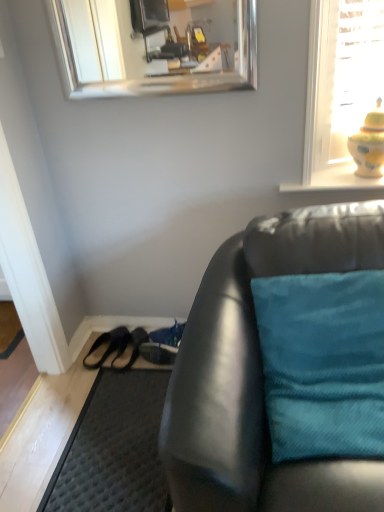
The width and height of the screenshot is (384, 512). Describe the element at coordinates (114, 449) in the screenshot. I see `dark gray textured doormat at lower left` at that location.

What do you see at coordinates (168, 335) in the screenshot?
I see `shiny blue shoe at lower center, the third shoe positioned from the left` at bounding box center [168, 335].

Where is `silver/metallic mirror at upper center`? This screenshot has height=512, width=384. silver/metallic mirror at upper center is located at coordinates (x=154, y=46).

In order to click on yellow glazed vase at upper right in this screenshot , I will do `click(369, 144)`.

How much space does black leather shoe at lower left, which appears as the first shoe when viewed from the left, occupy vertically?

black leather shoe at lower left, which appears as the first shoe when viewed from the left, is 3.40 inches in height.

Describe the element at coordinates (323, 362) in the screenshot. I see `teal fabric pillow at right` at that location.

Identify the location of matte black couch at lower right. The width and height of the screenshot is (384, 512). (258, 373).

Find the location of `dark gray textured doormat at lower left`. dark gray textured doormat at lower left is located at coordinates (114, 449).

Based on the photo, could you tell me if dark gray textured doormat at lower left is turned towards yellow glazed vase at upper right?

No, dark gray textured doormat at lower left is not facing towards yellow glazed vase at upper right.

Between dark gray textured doormat at lower left and yellow glazed vase at upper right, which one has smaller width?

Thinner between the two is yellow glazed vase at upper right.

From a real-world perspective, relative to yellow glazed vase at upper right, is dark gray textured doormat at lower left vertically above or below?

dark gray textured doormat at lower left is situated lower than yellow glazed vase at upper right in the real world.

What are the coordinates of `doormat below the yellow glazed vase at upper right (from the image's perspective)` in the screenshot? It's located at (114, 449).

Which object is thinner, black leather shoe at lower left, which appears as the first shoe when viewed from the left, or silver/metallic mirror at upper center?

Thinner between the two is silver/metallic mirror at upper center.

From the image's perspective, is black leather shoe at lower left, which appears as the first shoe when viewed from the left, on top of silver/metallic mirror at upper center?

Incorrect, from the image's perspective, black leather shoe at lower left, which appears as the first shoe when viewed from the left, is lower than silver/metallic mirror at upper center.

Who is taller, black leather shoe at lower left, which appears as the first shoe when viewed from the left, or silver/metallic mirror at upper center?

Standing taller between the two is silver/metallic mirror at upper center.

How many degrees apart are the facing directions of black leather shoe at lower left, which appears as the first shoe when viewed from the left, and silver/metallic mirror at upper center?

There is a 16.1-degree angle between the facing directions of black leather shoe at lower left, which appears as the first shoe when viewed from the left, and silver/metallic mirror at upper center.

Is dark gray textured doormat at lower left turned away from black leather sandals at lower left, the 2th shoe when ordered from left to right?

No, black leather sandals at lower left, the 2th shoe when ordered from left to right, is not at the back of dark gray textured doormat at lower left.

Is dark gray textured doormat at lower left wider than black leather sandals at lower left, the 2th shoe when ordered from right to left?

Yes, dark gray textured doormat at lower left is wider than black leather sandals at lower left, the 2th shoe when ordered from right to left.

Measure the distance from dark gray textured doormat at lower left to black leather sandals at lower left, the 2th shoe when ordered from left to right.

33.42 centimeters.

Can you confirm if dark gray textured doormat at lower left is smaller than black leather sandals at lower left, the 2th shoe when ordered from right to left?

No, dark gray textured doormat at lower left is not smaller than black leather sandals at lower left, the 2th shoe when ordered from right to left.

Which of these two, yellow glazed vase at upper right or dark gray textured doormat at lower left, is thinner?

yellow glazed vase at upper right.

Where is `doormat that is on the left side of yellow glazed vase at upper right`? The width and height of the screenshot is (384, 512). doormat that is on the left side of yellow glazed vase at upper right is located at coordinates (114, 449).

Can you confirm if yellow glazed vase at upper right is smaller than dark gray textured doormat at lower left?

Correct, yellow glazed vase at upper right occupies less space than dark gray textured doormat at lower left.

Can you confirm if black leather shoe at lower left, which appears as the first shoe when viewed from the left, is bigger than yellow glazed vase at upper right?

No, black leather shoe at lower left, which appears as the first shoe when viewed from the left, is not bigger than yellow glazed vase at upper right.

Which is less distant, (102, 356) or (373, 163)?

Point (373, 163)

Which object is wider, shiny blue shoe at lower center, the first shoe positioned from the right, or matte black couch at lower right?

Wider between the two is matte black couch at lower right.

Is shiny blue shoe at lower center, the third shoe positioned from the left, taller than matte black couch at lower right?

Incorrect, the height of shiny blue shoe at lower center, the third shoe positioned from the left, is not larger of that of matte black couch at lower right.

Can you confirm if shiny blue shoe at lower center, the third shoe positioned from the left, is bigger than matte black couch at lower right?

No.

Is shiny blue shoe at lower center, the third shoe positioned from the left, directly adjacent to matte black couch at lower right?

No, shiny blue shoe at lower center, the third shoe positioned from the left, is not in contact with matte black couch at lower right.

Consider the image. Considering the sizes of shiny blue shoe at lower center, the third shoe positioned from the left, and dark gray textured doormat at lower left in the image, is shiny blue shoe at lower center, the third shoe positioned from the left, bigger or smaller than dark gray textured doormat at lower left?

In the image, shiny blue shoe at lower center, the third shoe positioned from the left, appears to be smaller than dark gray textured doormat at lower left.

Is shiny blue shoe at lower center, the first shoe positioned from the right, aimed at dark gray textured doormat at lower left?

No, shiny blue shoe at lower center, the first shoe positioned from the right, does not turn towards dark gray textured doormat at lower left.

Is shiny blue shoe at lower center, the third shoe positioned from the left, beside dark gray textured doormat at lower left?

No, shiny blue shoe at lower center, the third shoe positioned from the left, is not touching dark gray textured doormat at lower left.

Locate an element on the screen. Image resolution: width=384 pixels, height=512 pixels. doormat in front of the yellow glazed vase at upper right is located at coordinates (114, 449).

I want to click on the 2nd shoe positioned below the silver/metallic mirror at upper center (from the image's perspective), so click(108, 346).

In the scene shown: Looking at the image, which one is located further to matte black couch at lower right, black leather sandals at lower left, the 2th shoe when ordered from right to left, or teal fabric pillow at right?

The object further to matte black couch at lower right is black leather sandals at lower left, the 2th shoe when ordered from right to left.

From the image, which object appears to be nearer to silver/metallic mirror at upper center, matte black couch at lower right or dark gray textured doormat at lower left?

The object closer to silver/metallic mirror at upper center is dark gray textured doormat at lower left.

Looking at the image, which one is located closer to yellow glazed vase at upper right, teal fabric pillow at right or silver/metallic mirror at upper center?

The object closer to yellow glazed vase at upper right is teal fabric pillow at right.

Which object lies further to the anchor point dark gray textured doormat at lower left, yellow glazed vase at upper right or silver/metallic mirror at upper center?

silver/metallic mirror at upper center.

Estimate the real-world distances between objects in this image. Which object is further from yellow glazed vase at upper right, dark gray textured doormat at lower left or matte black couch at lower right?

dark gray textured doormat at lower left is positioned further to the anchor yellow glazed vase at upper right.

Based on their spatial positions, is black leather shoe at lower left, the 3th shoe from the right, or teal fabric pillow at right further from shiny blue shoe at lower center, the third shoe positioned from the left?

The object further to shiny blue shoe at lower center, the third shoe positioned from the left, is teal fabric pillow at right.

Which object lies further to the anchor point black leather sandals at lower left, the 2th shoe when ordered from right to left, teal fabric pillow at right or yellow glazed vase at upper right?

yellow glazed vase at upper right is further to black leather sandals at lower left, the 2th shoe when ordered from right to left.

Considering their positions, is teal fabric pillow at right positioned closer to yellow glazed vase at upper right than matte black couch at lower right?

Among the two, matte black couch at lower right is located nearer to yellow glazed vase at upper right.

I want to click on pillow positioned between matte black couch at lower right and yellow glazed vase at upper right from near to far, so click(323, 362).

The height and width of the screenshot is (512, 384). Identify the location of shoe between matte black couch at lower right and black leather shoe at lower left, which appears as the first shoe when viewed from the left, in the front-back direction. (133, 346).

Locate an element on the screen. The height and width of the screenshot is (512, 384). toy between silver/metallic mirror at upper center and teal fabric pillow at right vertically is located at coordinates (369, 144).

Locate an element on the screen. doormat located between matte black couch at lower right and shiny blue shoe at lower center, the first shoe positioned from the right, in the depth direction is located at coordinates (114, 449).